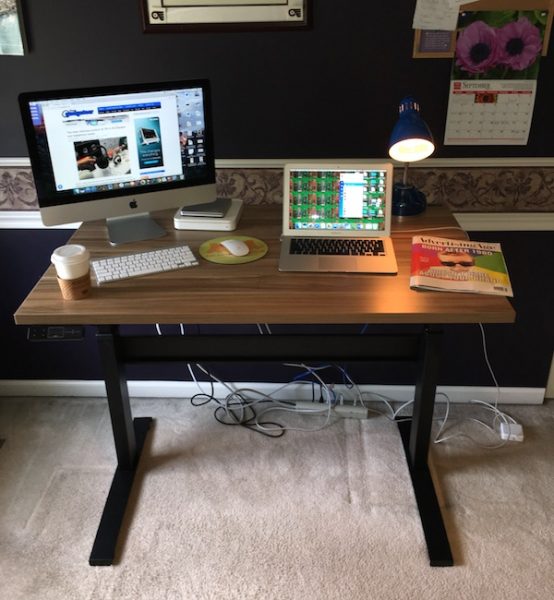
This screenshot has width=554, height=600. I want to click on cup, so click(x=66, y=267).